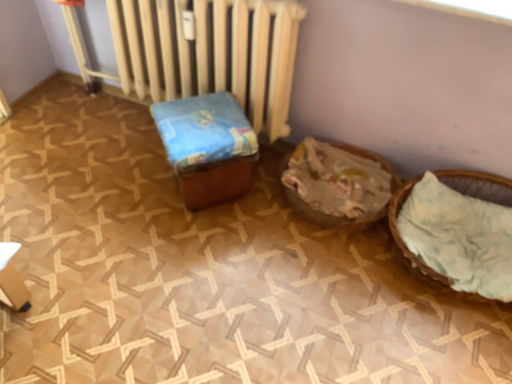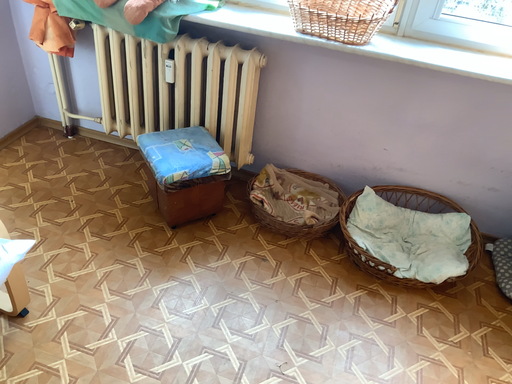
Question: Which way did the camera rotate in the video?

Choices:
 (A) rotated upward
 (B) rotated downward

Answer: (A)